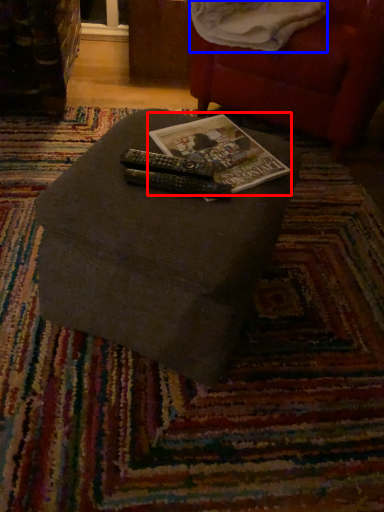
Question: Among these objects, which one is nearest to the camera, paperback book (highlighted by a red box) or blanket (highlighted by a blue box)?

Choices:
 (A) paperback book
 (B) blanket

Answer: (A)